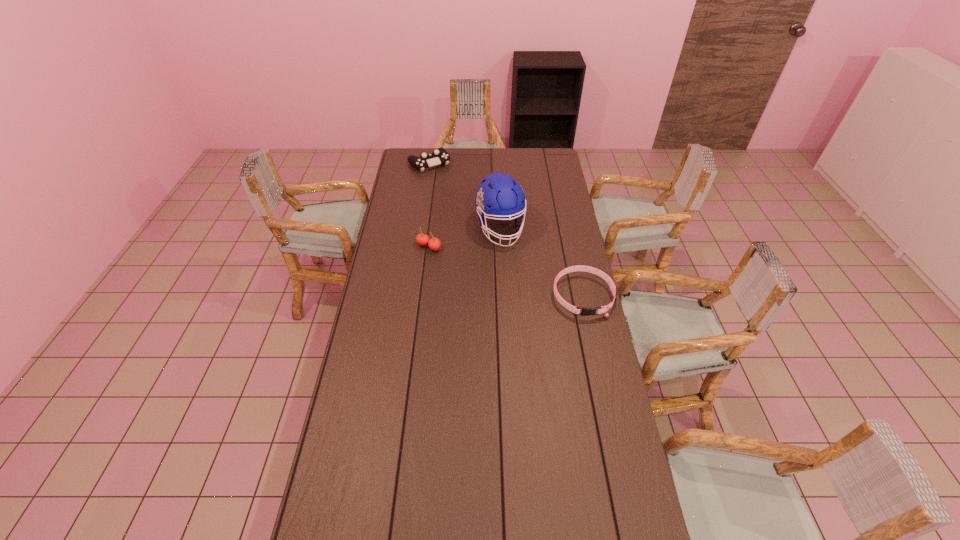
At what (x,y) coordinates should I click in order to perform the action: click on cherry. Please return your answer as a coordinate pair (x, y). Looking at the image, I should click on (434, 244).

The width and height of the screenshot is (960, 540). Identify the location of dog collar. (585, 311).

At what (x,y) coordinates should I click in order to perform the action: click on the shortest object. Please return your answer as a coordinate pair (x, y). The width and height of the screenshot is (960, 540). Looking at the image, I should click on (585, 311).

The height and width of the screenshot is (540, 960). Find the location of `the farthest object`. the farthest object is located at coordinates (440, 156).

In order to click on control in this screenshot , I will do `click(440, 156)`.

Where is `football helmet`? The image size is (960, 540). football helmet is located at coordinates (506, 196).

What are the coordinates of `the third object from left to right` in the screenshot? It's located at (506, 196).

Locate an element on the screen. The height and width of the screenshot is (540, 960). vacant space situated on the front of the third shortest object is located at coordinates (423, 291).

You are a GUI agent. You are given a task and a screenshot of the screen. Output one action in this format:
    pyautogui.click(x=<x>, y=<y>)
    Task: Click on the free region located with the buckle on the shortest object
    The width and height of the screenshot is (960, 540).
    Given the screenshot: What is the action you would take?
    point(609,413)

What are the coordinates of `blank space located on the surface of the control` in the screenshot? It's located at (443, 179).